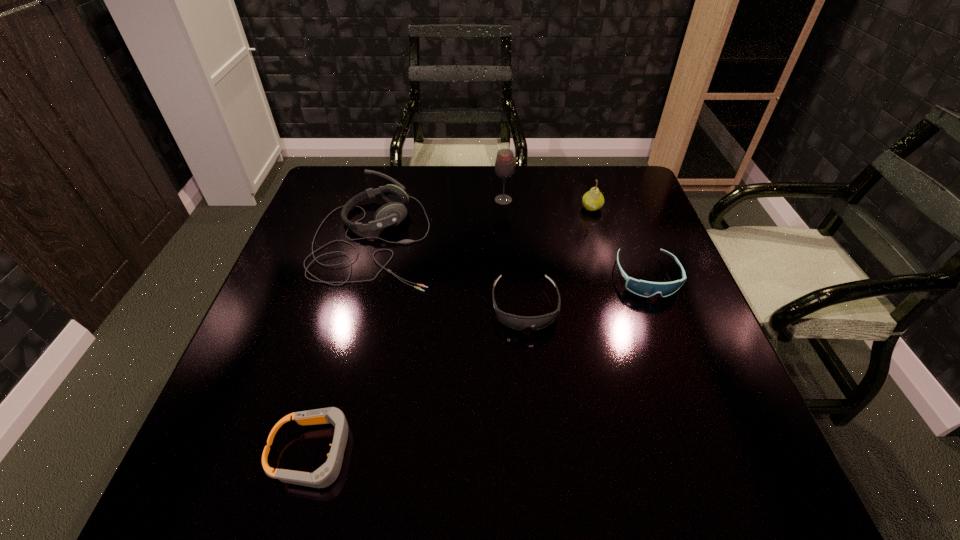
Locate an element on the screen. goggles located at the right edge is located at coordinates (642, 288).

You are a GUI agent. You are given a task and a screenshot of the screen. Output one action in this format:
    pyautogui.click(x=<x>, y=<y>)
    Task: Click on the object located at the far left corner
    
    Given the screenshot: What is the action you would take?
    pyautogui.click(x=391, y=214)

Find the location of a particular element. The image size is (960, 540). object positioned at the near left corner is located at coordinates (325, 475).

Where is `object that is positioned at the far right corner`? object that is positioned at the far right corner is located at coordinates (593, 200).

Locate an element on the screen. The image size is (960, 540). vacant area at the far edge is located at coordinates (560, 180).

Where is `free space at the left edge of the desktop`? free space at the left edge of the desktop is located at coordinates (294, 266).

Locate an element on the screen. vacant space at the right edge of the desktop is located at coordinates 698,432.

This screenshot has width=960, height=540. In the image, there is a desktop. What are the coordinates of `free region at the far left corner` in the screenshot? It's located at (358, 173).

Identify the location of free space at the far right corner. Image resolution: width=960 pixels, height=540 pixels. (625, 184).

You are a GUI agent. You are given a task and a screenshot of the screen. Output one action in this format:
    pyautogui.click(x=<x>, y=<y>)
    Task: Click on the empty location between the second goggles from right to left and the rightmost goggles
    The image size is (960, 540).
    Given the screenshot: What is the action you would take?
    pyautogui.click(x=586, y=292)